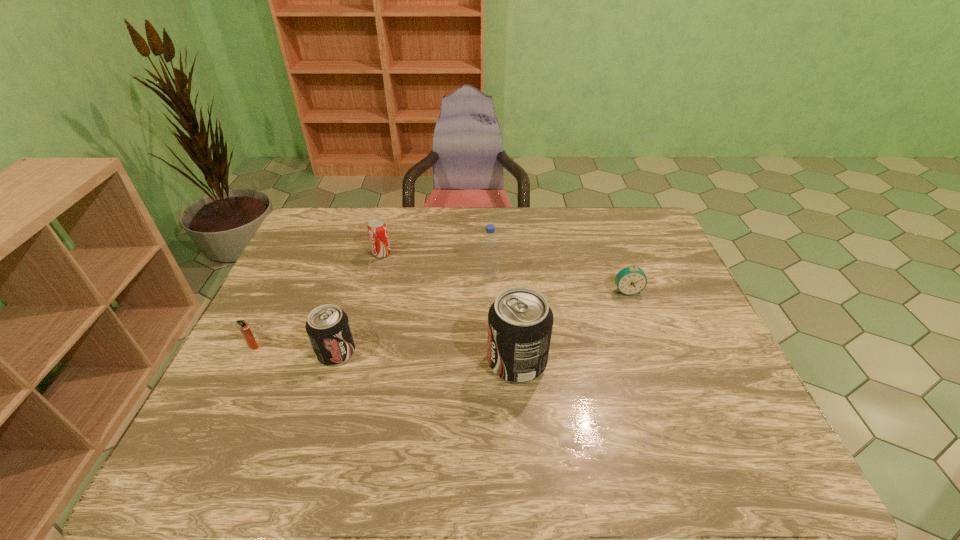
Identify the location of vacant region that satisfies the following two spatial constraints: 1. on the back side of the rightmost soda can; 2. on the logo side of the farthest object. (509, 253).

This screenshot has width=960, height=540. Identify the location of vacant space that satisfies the following two spatial constraints: 1. on the logo side of the farthest soda can; 2. on the right side of the bottle. (375, 277).